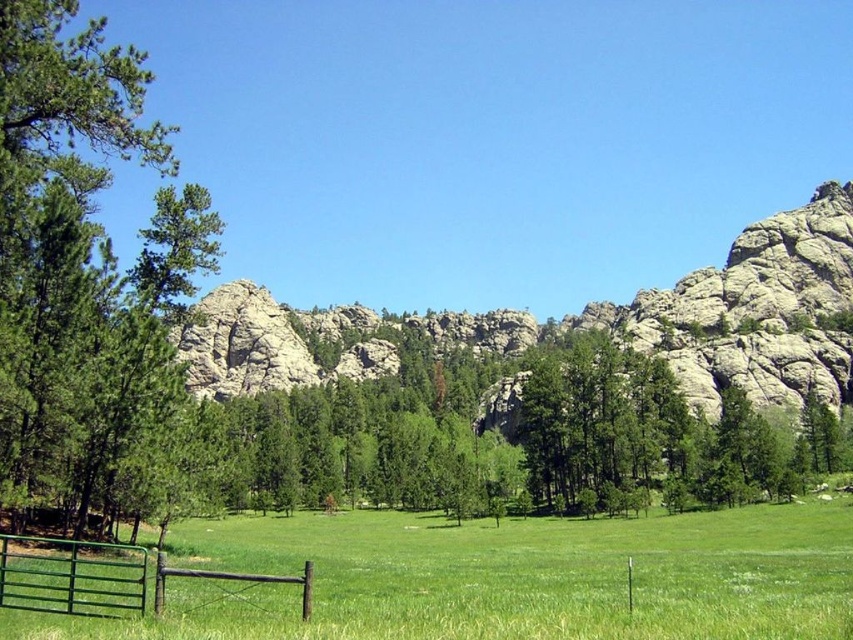
You are a painter setting up your easel in the meadow. You want to paint both the green matte tree at left and the green wooden gate at lower left. Which object should you move closer to if you want both to appear equally sized in your painting?

Since the green matte tree at left is bigger than the green wooden gate at lower left, you should move closer to the green wooden gate at lower left to make them appear the same size in your painting.